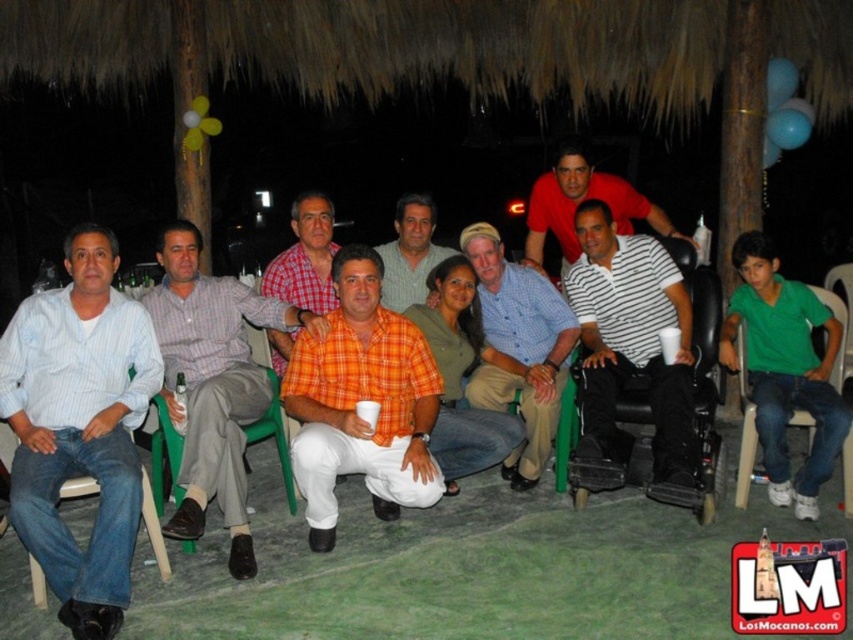
Question: Where is striped cotton shirt at center located in relation to white plastic chair at lower right in the image?

Choices:
 (A) below
 (B) above

Answer: (B)

Question: Estimate the real-world distances between objects in this image. Which object is farther from the denim plastic chair at lower left?

Choices:
 (A) matte red shirt at center
 (B) orange plaid shirt at center
 (C) white plastic chair at lower right
 (D) orange cotton shirt at center

Answer: (C)

Question: Which object is the farthest from the striped cotton shirt at center?

Choices:
 (A) matte red shirt at center
 (B) denim plastic chair at lower left
 (C) green plastic chair at center

Answer: (A)

Question: Is the position of matte red shirt at center less distant than that of denim plastic chair at lower left?

Choices:
 (A) yes
 (B) no

Answer: (B)

Question: Which object is the farthest from the orange plaid shirt at center?

Choices:
 (A) green plastic chair at center
 (B) white striped shirt at center
 (C) checkered fabric shirt at center
 (D) blue striped shirt at left

Answer: (B)

Question: Can you confirm if matte red shirt at center is positioned to the right of white plastic chair at lower right?

Choices:
 (A) no
 (B) yes

Answer: (A)